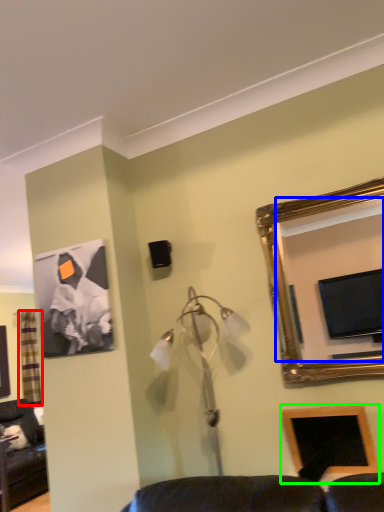
Question: Based on their relative distances, which object is nearer to curtain (highlighted by a red box)? Choose from mirror (highlighted by a blue box) and picture frame (highlighted by a green box).

Choices:
 (A) mirror
 (B) picture frame

Answer: (B)